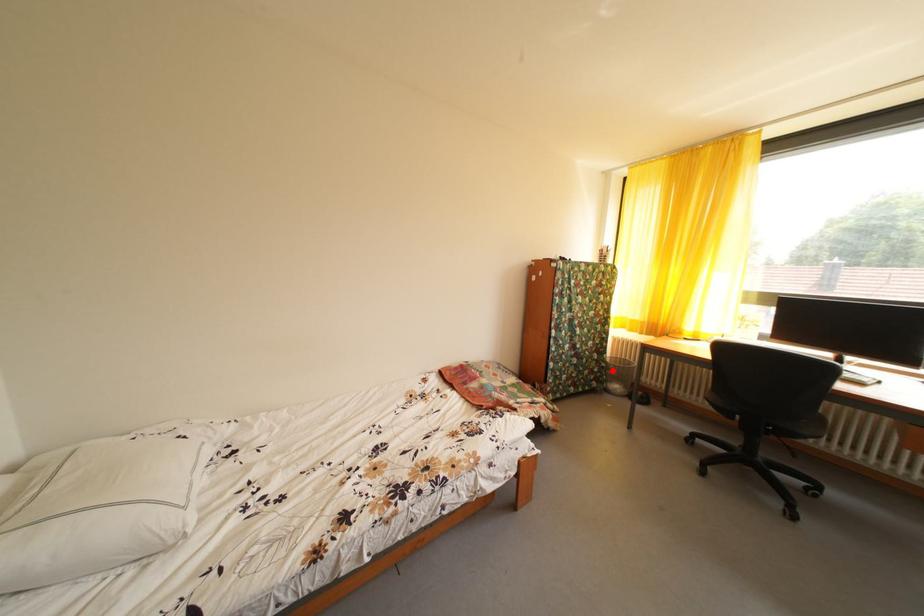
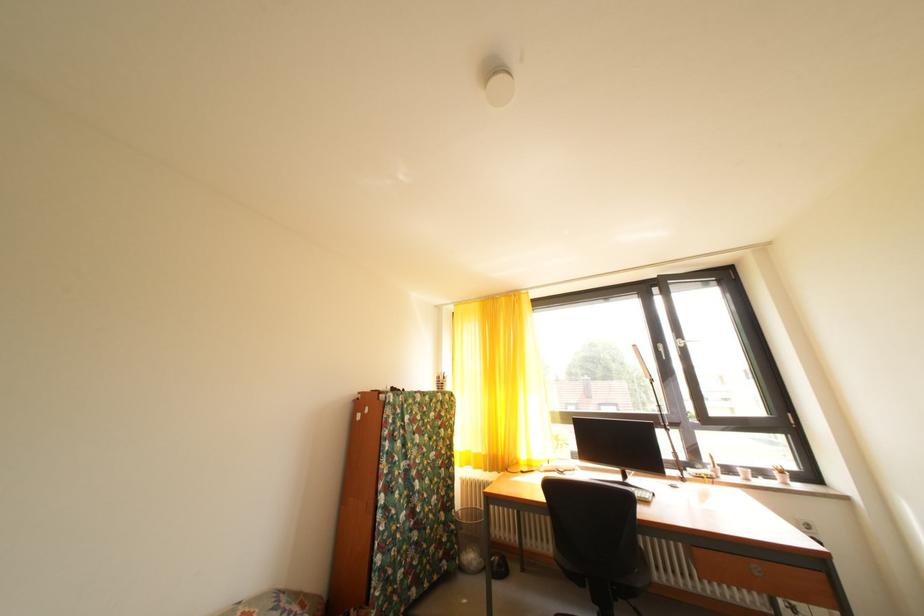
Question: I am providing you with two images of the same scene from different viewpoints. In image1, a red point is highlighted. Considering the same 3D point in image2, which of the following is correct?

Choices:
 (A) It is closer
 (B) It is farther

Answer: (A)